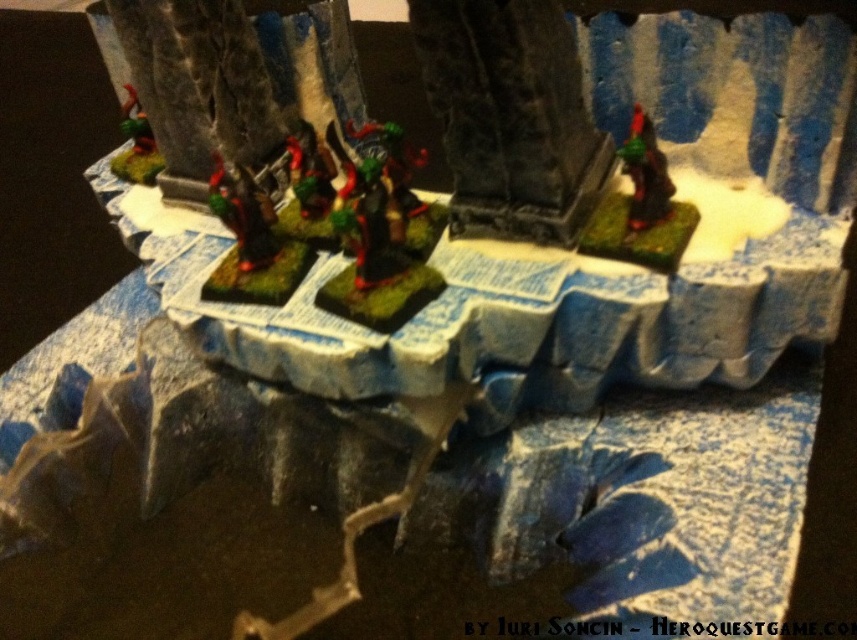
You are a player in a tabletop game and need to move your matte black figure at center closer to the green matte miniature at upper right. Which direction should you move it?

The matte black figure at center is already positioned on the left side of the green matte miniature at upper right, so moving it to the right would bring it closer to the green matte miniature at upper right.

You are a player in a tabletop game and need to move your shiny red plastic figure at right closer to the matte black figure at center. Which direction should you move it?

The shiny red plastic figure at right is already positioned on the right side of the matte black figure at center, so to move closer, you should move it to the left towards the center.

You are a player in a tabletop game and need to move your shiny red plastic figure at right to a position closer to the central rocky outcrop. Based on its current coordinates, can you determine if it is positioned to the left or right of the central rocky outcrop?

The shiny red plastic figure at right is located at point 0.327 on the x and 0.748 on the y. Since the central rocky outcrop is part of the terrain base, which is in the center of the image, the figure is positioned to the right of it.